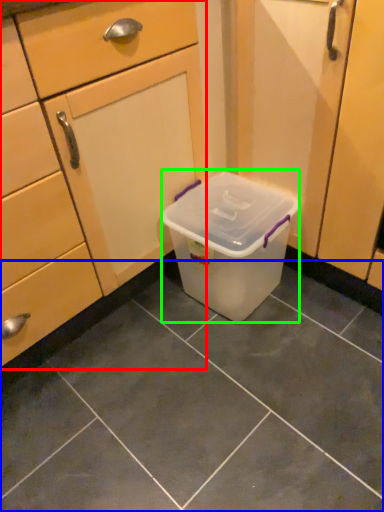
Question: Considering the real-world distances, which object is closest to cabinetry (highlighted by a red box)? tile (highlighted by a blue box) or storage box (highlighted by a green box).

Choices:
 (A) tile
 (B) storage box

Answer: (B)